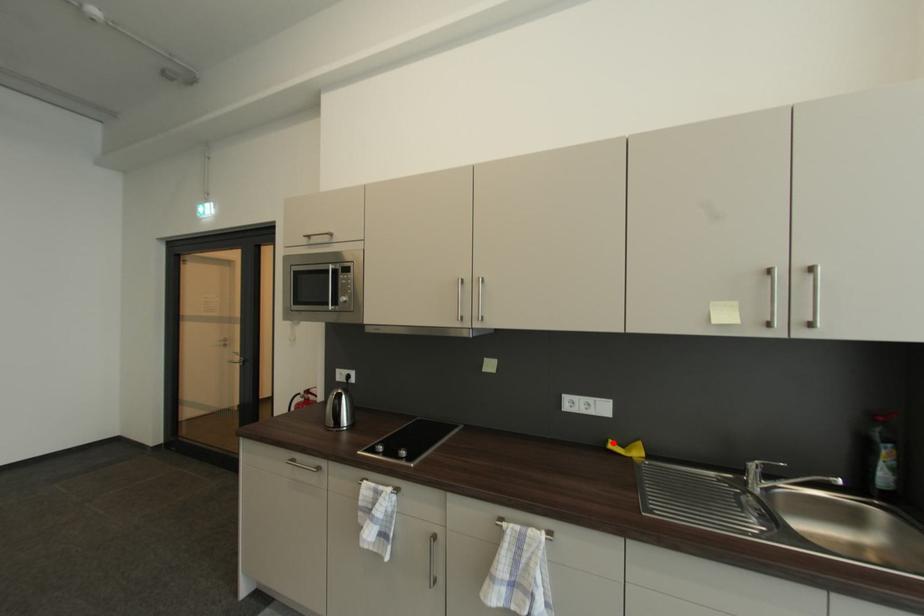
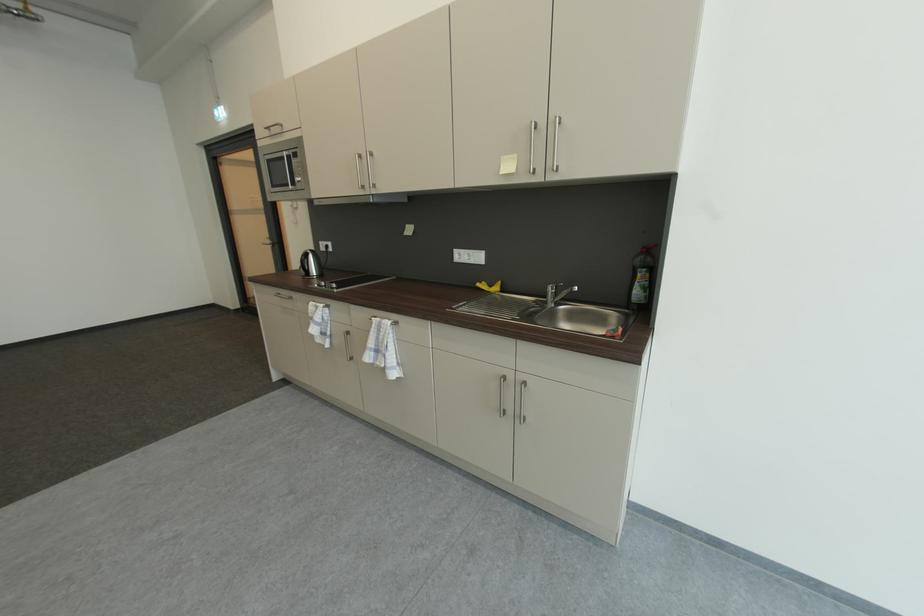
Question: I am providing you with two images of the same scene from different viewpoints. In image1, a red point is highlighted. Considering the same 3D point in image2, which of the following is correct?

Choices:
 (A) It is closer
 (B) It is farther

Answer: (A)